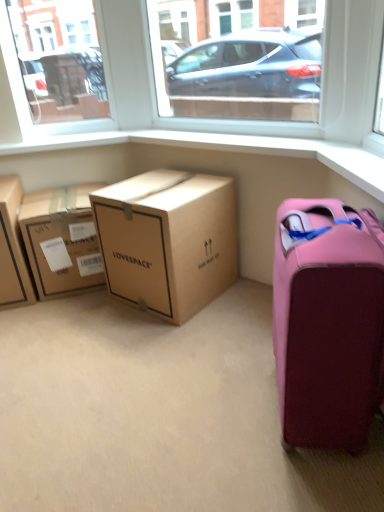
Identify the location of transparent glass window at upper left, which is counted as the second window screen, starting from the right. (52, 98).

Image resolution: width=384 pixels, height=512 pixels. What do you see at coordinates (328, 322) in the screenshot?
I see `pink matte suitcase at lower right` at bounding box center [328, 322].

Identify the location of transparent glass window at upper left, the 1th window screen positioned from the left. (52, 98).

From a real-world perspective, is pink matte suitcase at lower right located higher than matte brown cardboard box at left, the third box from the right?

Yes, from a real-world perspective, pink matte suitcase at lower right is over matte brown cardboard box at left, the third box from the right

Between pink matte suitcase at lower right and matte brown cardboard box at left, the third box from the right, which one appears on the right side from the viewer's perspective?

pink matte suitcase at lower right is more to the right.

Is point (314, 372) more distant than point (5, 284)?

No.

From the picture: Is matte brown cardboard box at left, the third box from the right, inside pink matte suitcase at lower right?

No, pink matte suitcase at lower right does not contain matte brown cardboard box at left, the third box from the right.

In the scene shown: Considering the relative positions of brown cardboard box at center, which is the second box in left-to-right order, and pink matte suitcase at lower right in the image provided, is brown cardboard box at center, which is the second box in left-to-right order, to the right of pink matte suitcase at lower right from the viewer's perspective?

No, brown cardboard box at center, which is the second box in left-to-right order, is not to the right of pink matte suitcase at lower right.

Is brown cardboard box at center, which is the second box in left-to-right order, looking in the opposite direction of pink matte suitcase at lower right?

brown cardboard box at center, which is the second box in left-to-right order, does not have its back to pink matte suitcase at lower right.

You are a GUI agent. You are given a task and a screenshot of the screen. Output one action in this format:
    pyautogui.click(x=<x>, y=<y>)
    Task: Click on the suitcase that is above the brown cardboard box at center, which is the second box in left-to-right order (from a real-world perspective)
    This screenshot has height=512, width=384.
    Given the screenshot: What is the action you would take?
    pyautogui.click(x=328, y=322)

Based on their sizes in the image, would you say brown cardboard box at center, which is the second box in left-to-right order, is bigger or smaller than pink matte suitcase at lower right?

Clearly, brown cardboard box at center, which is the second box in left-to-right order, is smaller in size than pink matte suitcase at lower right.

Is transparent glass window at upper center, which ranks as the first window screen in right-to-left order, looking in the opposite direction of brown cardboard box at center, which is the third box from left to right?

No.

From the image's perspective, which is below, transparent glass window at upper center, which ranks as the 2th window screen in left-to-right order, or brown cardboard box at center, which is the third box from left to right?

brown cardboard box at center, which is the third box from left to right.

Between point (317, 40) and point (135, 247), which one is positioned in front?

Point (135, 247)

What's the angular difference between transparent glass window at upper center, which ranks as the 2th window screen in left-to-right order, and brown cardboard box at center, the first box positioned from the right,'s facing directions?

They differ by 0.93 degrees in their facing directions.

I want to click on box that is under the brown cardboard box at center, the first box positioned from the right (from a real-world perspective), so click(62, 240).

Looking at this image, which is in front, brown cardboard box at center, which appears as the second box when viewed from the right, or brown cardboard box at center, which is the third box from left to right?

Positioned in front is brown cardboard box at center, which is the third box from left to right.

From the picture: Considering the relative sizes of brown cardboard box at center, which is the second box in left-to-right order, and brown cardboard box at center, which is the third box from left to right, in the image provided, is brown cardboard box at center, which is the second box in left-to-right order, thinner than brown cardboard box at center, which is the third box from left to right,?

Yes.

Considering the relative sizes of brown cardboard box at center, which is the second box in left-to-right order, and brown cardboard box at center, the first box positioned from the right, in the image provided, is brown cardboard box at center, which is the second box in left-to-right order, smaller than brown cardboard box at center, the first box positioned from the right,?

Yes, brown cardboard box at center, which is the second box in left-to-right order, is smaller than brown cardboard box at center, the first box positioned from the right.

Is matte brown cardboard box at left, the third box from the right, facing towards transparent glass window at upper left, which is counted as the second window screen, starting from the right?

No, matte brown cardboard box at left, the third box from the right, is not facing towards transparent glass window at upper left, which is counted as the second window screen, starting from the right.

Are matte brown cardboard box at left, arranged as the 1th box when viewed from the left, and transparent glass window at upper left, which is counted as the second window screen, starting from the right, making contact?

No, matte brown cardboard box at left, arranged as the 1th box when viewed from the left, is not touching transparent glass window at upper left, which is counted as the second window screen, starting from the right.

Considering the relative sizes of matte brown cardboard box at left, the third box from the right, and transparent glass window at upper left, which is counted as the second window screen, starting from the right, in the image provided, is matte brown cardboard box at left, the third box from the right, taller than transparent glass window at upper left, which is counted as the second window screen, starting from the right,?

Incorrect, the height of matte brown cardboard box at left, the third box from the right, is not larger of that of transparent glass window at upper left, which is counted as the second window screen, starting from the right.

Considering the points (27, 271) and (12, 7), which point is in front, point (27, 271) or point (12, 7)?

The point (12, 7) is more forward.

Which object is positioned more to the right, transparent glass window at upper center, which ranks as the first window screen in right-to-left order, or matte brown cardboard box at left, the third box from the right?

transparent glass window at upper center, which ranks as the first window screen in right-to-left order.

Between transparent glass window at upper center, which ranks as the 2th window screen in left-to-right order, and matte brown cardboard box at left, the third box from the right, which one has smaller size?

Smaller between the two is transparent glass window at upper center, which ranks as the 2th window screen in left-to-right order.

Considering the relative sizes of transparent glass window at upper center, which ranks as the first window screen in right-to-left order, and matte brown cardboard box at left, the third box from the right, in the image provided, is transparent glass window at upper center, which ranks as the first window screen in right-to-left order, wider than matte brown cardboard box at left, the third box from the right,?

Incorrect, the width of transparent glass window at upper center, which ranks as the first window screen in right-to-left order, does not surpass that of matte brown cardboard box at left, the third box from the right.

Measure the distance from transparent glass window at upper center, which ranks as the 2th window screen in left-to-right order, to matte brown cardboard box at left, the third box from the right.

transparent glass window at upper center, which ranks as the 2th window screen in left-to-right order, and matte brown cardboard box at left, the third box from the right, are 7.71 feet apart from each other.

Does transparent glass window at upper center, which ranks as the first window screen in right-to-left order, appear on the left side of pink matte suitcase at lower right?

Indeed, transparent glass window at upper center, which ranks as the first window screen in right-to-left order, is positioned on the left side of pink matte suitcase at lower right.

Between transparent glass window at upper center, which ranks as the 2th window screen in left-to-right order, and pink matte suitcase at lower right, which one has larger size?

Bigger between the two is pink matte suitcase at lower right.

From a real-world perspective, between transparent glass window at upper center, which ranks as the first window screen in right-to-left order, and pink matte suitcase at lower right, who is vertically lower?

pink matte suitcase at lower right is physically lower.

What are the coordinates of `suitcase lying on the right of matte brown cardboard box at left, arranged as the 1th box when viewed from the left` in the screenshot? It's located at (328, 322).

Locate an element on the screen. The width and height of the screenshot is (384, 512). box that is the 3rd object located above the pink matte suitcase at lower right (from the image's perspective) is located at coordinates (62, 240).

When comparing their distances from transparent glass window at upper center, which ranks as the 2th window screen in left-to-right order, does transparent glass window at upper left, the 1th window screen positioned from the left, or brown cardboard box at center, which appears as the second box when viewed from the right, seem further?

brown cardboard box at center, which appears as the second box when viewed from the right, lies further to transparent glass window at upper center, which ranks as the 2th window screen in left-to-right order, than the other object.

Looking at the image, which one is located closer to transparent glass window at upper left, which is counted as the second window screen, starting from the right, transparent glass window at upper center, which ranks as the 2th window screen in left-to-right order, or matte brown cardboard box at left, the third box from the right?

matte brown cardboard box at left, the third box from the right, lies closer to transparent glass window at upper left, which is counted as the second window screen, starting from the right, than the other object.

Looking at the image, which one is located further to transparent glass window at upper center, which ranks as the 2th window screen in left-to-right order, pink matte suitcase at lower right or transparent glass window at upper left, the 1th window screen positioned from the left?

pink matte suitcase at lower right is further to transparent glass window at upper center, which ranks as the 2th window screen in left-to-right order.

Based on their spatial positions, is transparent glass window at upper center, which ranks as the 2th window screen in left-to-right order, or transparent glass window at upper left, which is counted as the second window screen, starting from the right, closer to brown cardboard box at center, which is the second box in left-to-right order?

The object closer to brown cardboard box at center, which is the second box in left-to-right order, is transparent glass window at upper left, which is counted as the second window screen, starting from the right.

Which object lies nearer to the anchor point matte brown cardboard box at left, the third box from the right, transparent glass window at upper left, the 1th window screen positioned from the left, or transparent glass window at upper center, which ranks as the first window screen in right-to-left order?

Among the two, transparent glass window at upper left, the 1th window screen positioned from the left, is located nearer to matte brown cardboard box at left, the third box from the right.

Based on their spatial positions, is brown cardboard box at center, which is the third box from left to right, or matte brown cardboard box at left, arranged as the 1th box when viewed from the left, further from transparent glass window at upper center, which ranks as the first window screen in right-to-left order?

The object further to transparent glass window at upper center, which ranks as the first window screen in right-to-left order, is matte brown cardboard box at left, arranged as the 1th box when viewed from the left.

Considering their positions, is brown cardboard box at center, which is the second box in left-to-right order, positioned closer to matte brown cardboard box at left, the third box from the right, than transparent glass window at upper left, which is counted as the second window screen, starting from the right?

Based on the image, brown cardboard box at center, which is the second box in left-to-right order, appears to be nearer to matte brown cardboard box at left, the third box from the right.

When comparing their distances from matte brown cardboard box at left, the third box from the right, does brown cardboard box at center, which is the second box in left-to-right order, or brown cardboard box at center, the first box positioned from the right, seem closer?

brown cardboard box at center, which is the second box in left-to-right order, is positioned closer to the anchor matte brown cardboard box at left, the third box from the right.

Locate an element on the screen. The height and width of the screenshot is (512, 384). box between matte brown cardboard box at left, the third box from the right, and brown cardboard box at center, the first box positioned from the right is located at coordinates [x=62, y=240].

Find the location of a particular element. The height and width of the screenshot is (512, 384). window screen between matte brown cardboard box at left, the third box from the right, and transparent glass window at upper center, which ranks as the first window screen in right-to-left order is located at coordinates (52, 98).

Find the location of a particular element. The width and height of the screenshot is (384, 512). window screen between transparent glass window at upper left, which is counted as the second window screen, starting from the right, and brown cardboard box at center, which is the third box from left to right, vertically is located at coordinates (236, 62).

This screenshot has width=384, height=512. What are the coordinates of `box between transparent glass window at upper left, which is counted as the second window screen, starting from the right, and matte brown cardboard box at left, arranged as the 1th box when viewed from the left, from top to bottom` in the screenshot? It's located at (62, 240).